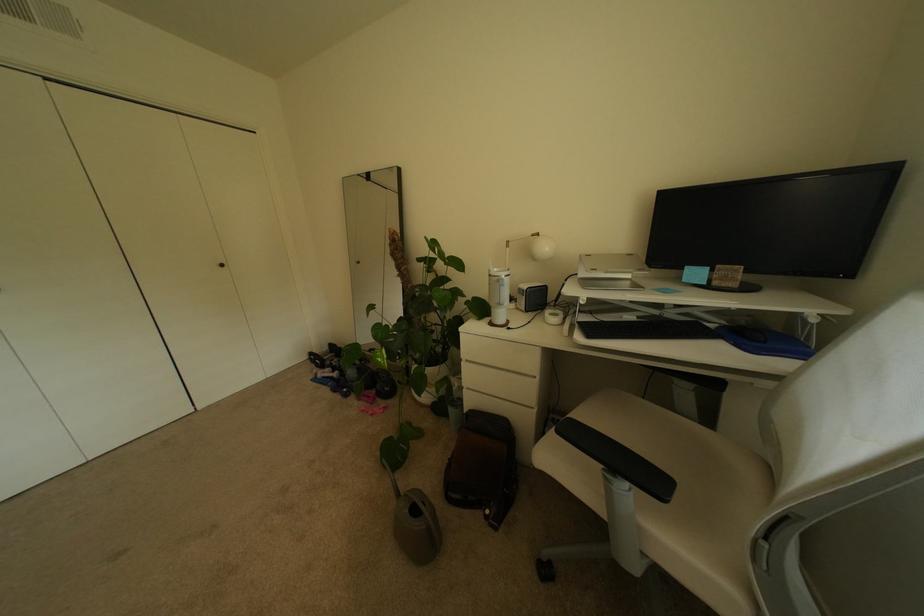
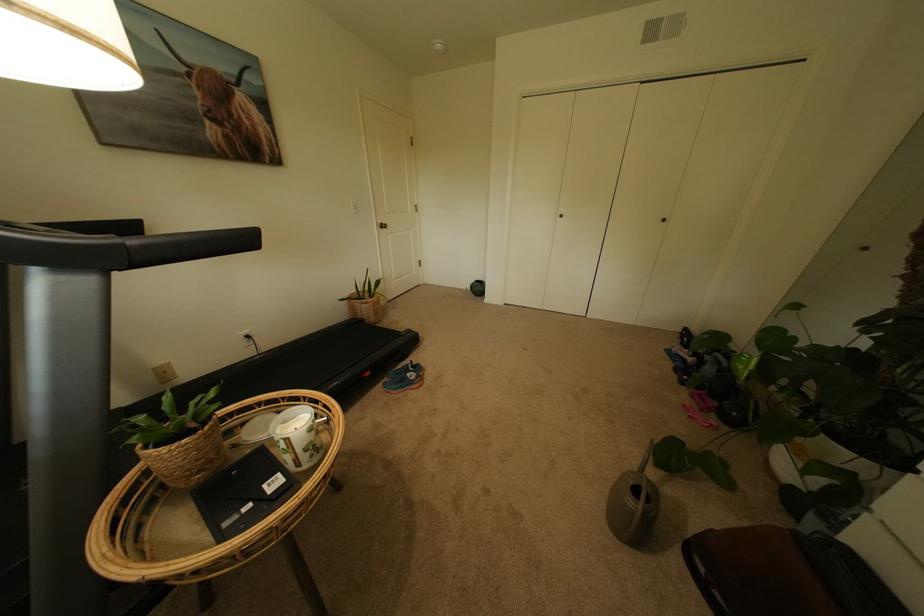
In the second image, find the point that corresponds to the point at 416,513 in the first image.

(639, 484)